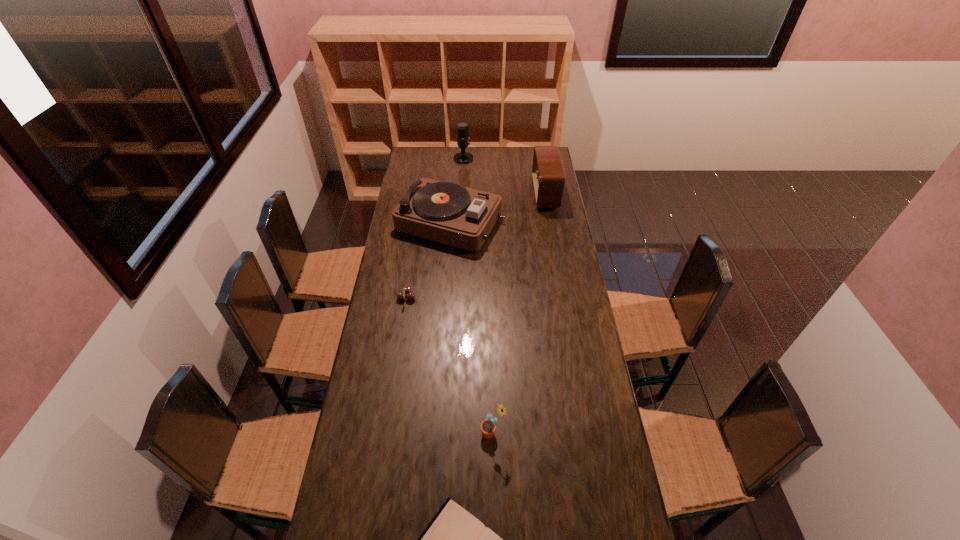
Where is `the farthest object`? Image resolution: width=960 pixels, height=540 pixels. the farthest object is located at coordinates (463, 139).

I want to click on radio receiver, so click(548, 176).

This screenshot has width=960, height=540. What are the coordinates of `the fifth farthest object` in the screenshot? It's located at (488, 426).

The image size is (960, 540). I want to click on record player, so click(x=446, y=212).

Identify the location of the third nearest object. Image resolution: width=960 pixels, height=540 pixels. (410, 296).

Identify the location of cherry. (410, 296).

Identify the location of vacant space located 0.280m on the side of the microphone with the red ring. This screenshot has width=960, height=540. (522, 159).

Where is `vacant space located on the front-facing side of the rightmost object`? vacant space located on the front-facing side of the rightmost object is located at coordinates (518, 194).

Locate an element on the screen. This screenshot has width=960, height=540. free space located on the front-facing side of the rightmost object is located at coordinates (483, 194).

In order to click on vacant space situated 0.350m on the front-facing side of the rightmost object in this screenshot , I will do `click(466, 194)`.